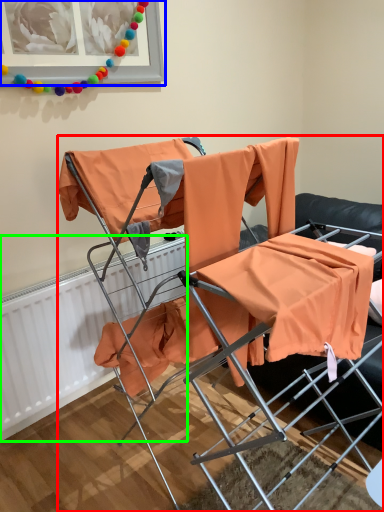
Question: Based on their relative distances, which object is nearer to chair (highlighted by a red box)? Choose from picture frame (highlighted by a blue box) and radiator (highlighted by a green box).

Choices:
 (A) picture frame
 (B) radiator

Answer: (B)